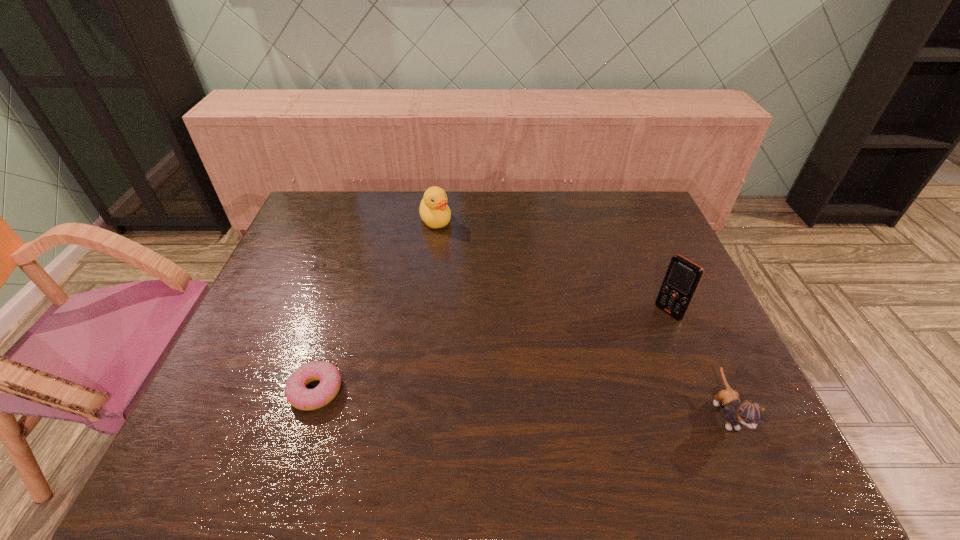
Locate an element on the screen. Image resolution: width=960 pixels, height=540 pixels. vacant space at the far edge of the desktop is located at coordinates (496, 199).

Identify the location of vacant space at the near edge of the desktop. (421, 414).

This screenshot has width=960, height=540. I want to click on free space at the left edge of the desktop, so click(300, 301).

In the image, there is a desktop. In order to click on vacant region at the far left corner in this screenshot , I will do `click(335, 221)`.

Where is `free space at the far right corner of the desktop`? The width and height of the screenshot is (960, 540). free space at the far right corner of the desktop is located at coordinates (647, 221).

You are a GUI agent. You are given a task and a screenshot of the screen. Output one action in this format:
    pyautogui.click(x=<x>, y=<y>)
    Task: Click on the unoccupied area between the leftmost object and the farthest object
    The height and width of the screenshot is (540, 960).
    Given the screenshot: What is the action you would take?
    pyautogui.click(x=376, y=306)

Identify the location of vacant space in between the doughnut and the third shortest object. (376, 306).

The image size is (960, 540). In order to click on free space between the third shortest object and the kitten in this screenshot , I will do `click(581, 317)`.

Where is `empty location between the kitten and the duck`? empty location between the kitten and the duck is located at coordinates (581, 317).

Locate an element on the screen. The height and width of the screenshot is (540, 960). empty space that is in between the shortest object and the kitten is located at coordinates (520, 402).